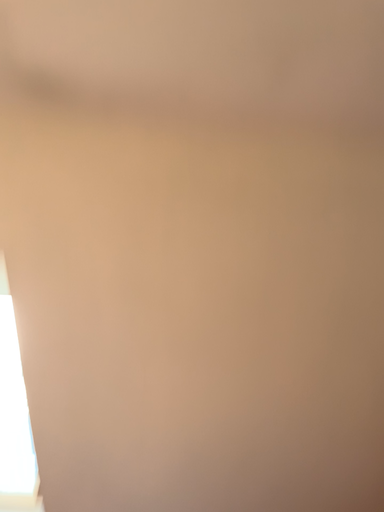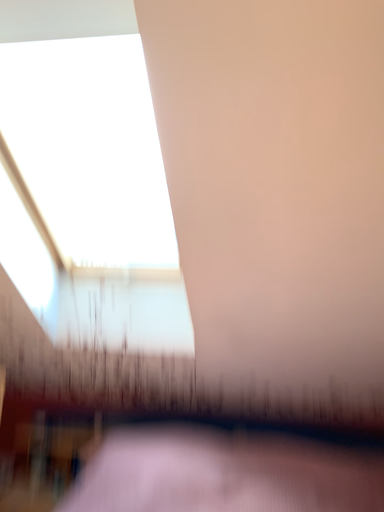
Question: How did the camera likely rotate when shooting the video?

Choices:
 (A) rotated upward
 (B) rotated downward

Answer: (B)